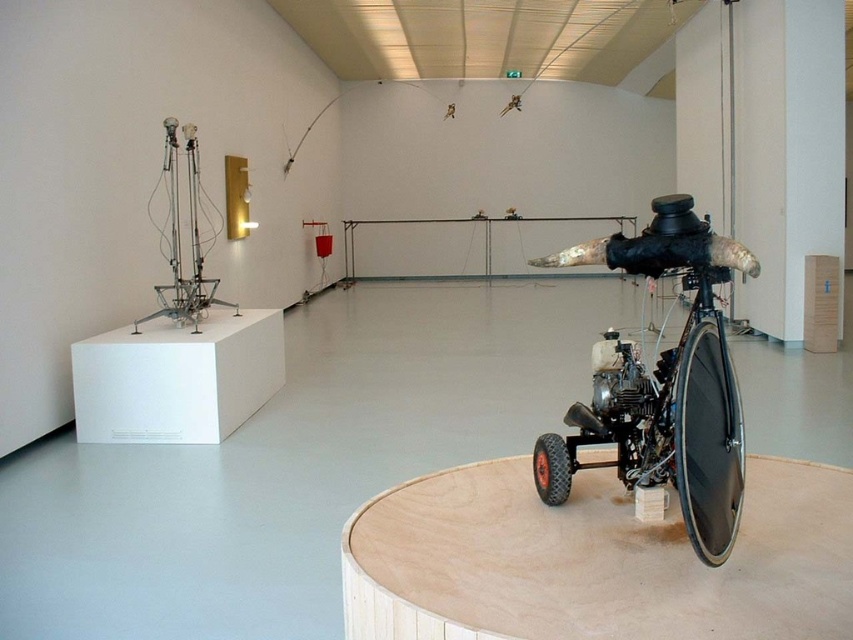
Can you confirm if metallic matte bicycle at center is positioned to the left of black rubber wheel at lower right?

In fact, metallic matte bicycle at center is to the right of black rubber wheel at lower right.

Between point (682, 200) and point (674, 426), which one is positioned in front?

Positioned in front is point (674, 426).

Is point (740, 422) positioned before point (712, 538)?

No.

You are a GUI agent. You are given a task and a screenshot of the screen. Output one action in this format:
    pyautogui.click(x=<x>, y=<y>)
    Task: Click on the metallic matte bicycle at center
    This screenshot has width=853, height=640.
    Given the screenshot: What is the action you would take?
    pyautogui.click(x=671, y=378)

Is black rubber wheel at lower right below rubber/textured wheel at lower center?

Actually, black rubber wheel at lower right is above rubber/textured wheel at lower center.

Who is more forward, (695, 524) or (566, 465)?

Positioned in front is point (695, 524).

What are the coordinates of `black rubber wheel at lower right` in the screenshot? It's located at (708, 442).

Which is above, metallic matte bicycle at center or rubber/textured wheel at lower center?

Positioned higher is metallic matte bicycle at center.

Between metallic matte bicycle at center and rubber/textured wheel at lower center, which one has less height?

With less height is rubber/textured wheel at lower center.

Is point (695, 380) less distant than point (547, 477)?

That is True.

The height and width of the screenshot is (640, 853). Find the location of `metallic matte bicycle at center`. metallic matte bicycle at center is located at coordinates (671, 378).